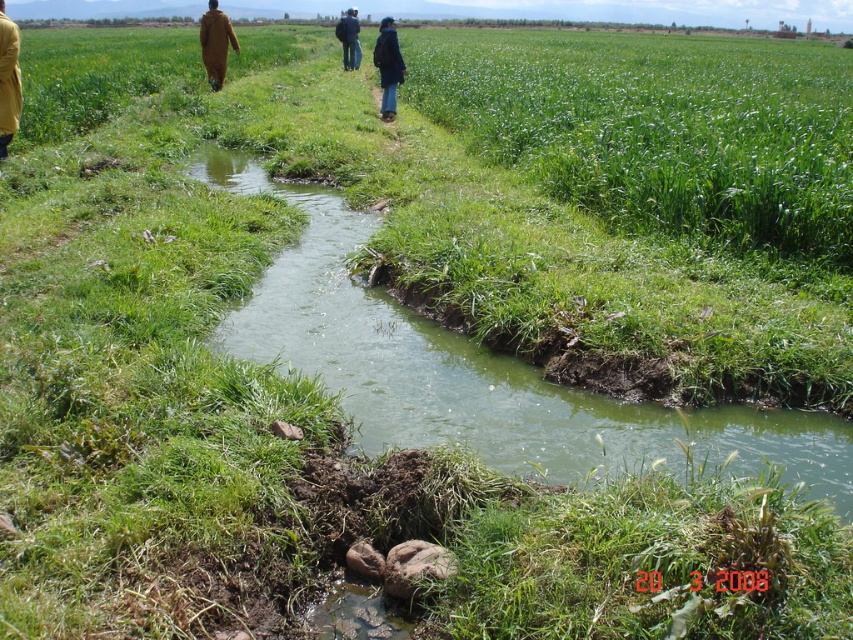
Question: Which point is closer to the camera?

Choices:
 (A) blue fabric jacket at center
 (B) brown woolen coat at upper center
 (C) black matte jacket at center

Answer: (C)

Question: Which of these objects is positioned farthest from the brown woolen coat at upper center?

Choices:
 (A) matte yellow coat at left
 (B) blue fabric jacket at center
 (C) black matte jacket at center

Answer: (B)

Question: Is brown woolen coat at upper center thinner than blue fabric jacket at center?

Choices:
 (A) no
 (B) yes

Answer: (B)

Question: Is matte yellow coat at left below blue fabric jacket at center?

Choices:
 (A) no
 (B) yes

Answer: (B)

Question: Is matte yellow coat at left smaller than brown woolen coat at upper center?

Choices:
 (A) no
 (B) yes

Answer: (B)

Question: Estimate the real-world distances between objects in this image. Which object is farther from the matte yellow coat at left?

Choices:
 (A) black matte jacket at center
 (B) blue fabric jacket at center
 (C) brown woolen coat at upper center

Answer: (B)